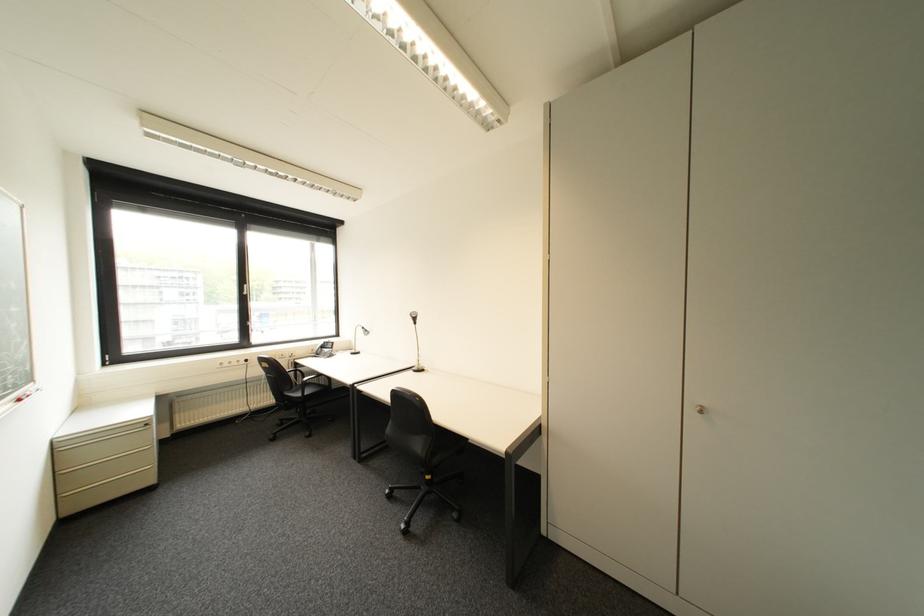
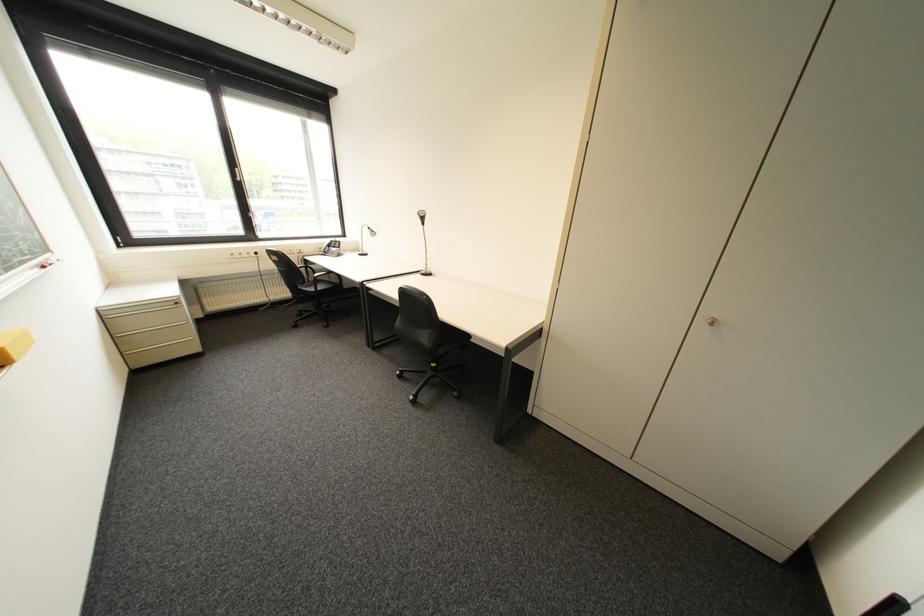
Question: Based on the continuous images, in which direction is the camera rotating? Reply with the corresponding letter.

Choices:
 (A) Left
 (B) Right
 (C) Up
 (D) Down

Answer: (D)